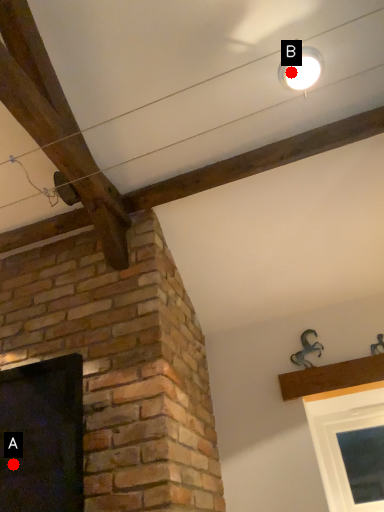
Question: Two points are circled on the image, labeled by A and B beside each circle. Which point is farther to the camera?

Choices:
 (A) A is further
 (B) B is further

Answer: (A)